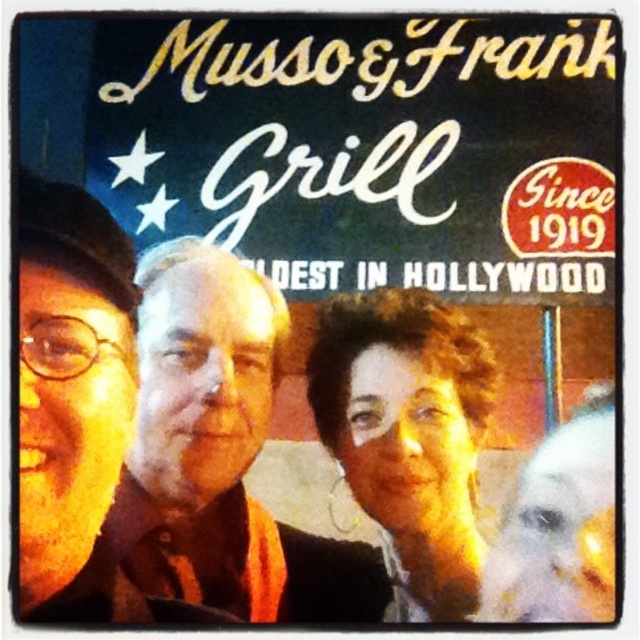
Based on the photo, between smooth brown shirt at center and curly hair at center, which one is positioned lower?

Positioned lower is curly hair at center.

Can you confirm if smooth brown shirt at center is wider than curly hair at center?

Yes, smooth brown shirt at center is wider than curly hair at center.

Where is `smooth brown shirt at center`? Image resolution: width=640 pixels, height=640 pixels. smooth brown shirt at center is located at coordinates (220, 452).

Who is lower down, smooth brown shirt at center or matte black glasses at left?

smooth brown shirt at center is below.

You are a GUI agent. You are given a task and a screenshot of the screen. Output one action in this format:
    pyautogui.click(x=<x>, y=<y>)
    Task: Click on the smooth brown shirt at center
    The height and width of the screenshot is (640, 640).
    Given the screenshot: What is the action you would take?
    pyautogui.click(x=220, y=452)

Based on the photo, which is below, matte black glasses at left or curly hair at center?

curly hair at center is lower down.

Which is behind, point (61, 488) or point (340, 404)?

The point (340, 404) is behind.

What do you see at coordinates (72, 400) in the screenshot?
I see `matte black glasses at left` at bounding box center [72, 400].

You are a GUI agent. You are given a task and a screenshot of the screen. Output one action in this format:
    pyautogui.click(x=<x>, y=<y>)
    Task: Click on the matte black glasses at left
    Image resolution: width=640 pixels, height=640 pixels.
    Given the screenshot: What is the action you would take?
    pyautogui.click(x=72, y=400)